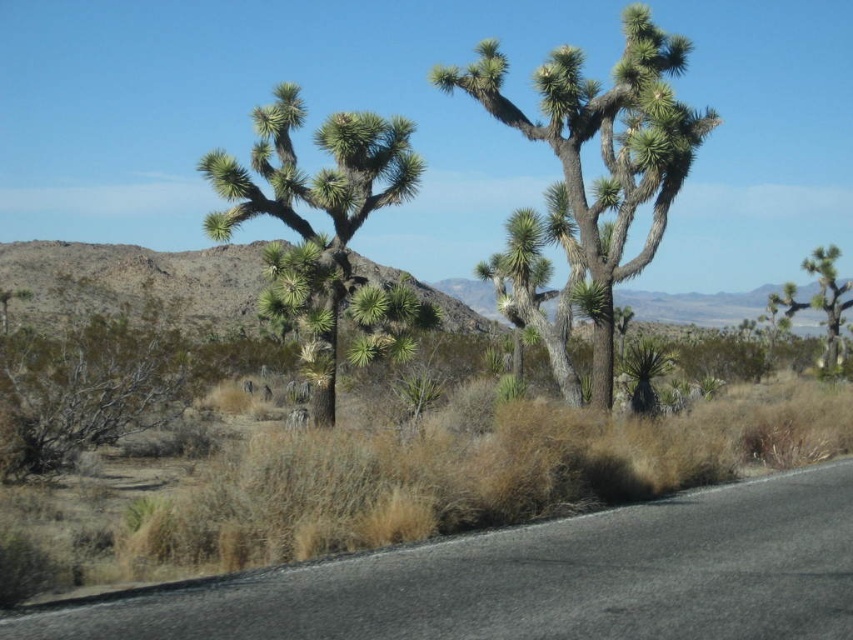
Question: Among these objects, which one is nearest to the camera?

Choices:
 (A) green spiky cactus at center
 (B) green spiky cactus at right
 (C) green spiky plant at center

Answer: (C)

Question: Which object appears farthest from the camera in this image?

Choices:
 (A) green spiky cactus at center
 (B) green spiky cactus at right

Answer: (B)

Question: Does green spiky plant at center have a larger size compared to green spiky cactus at center?

Choices:
 (A) yes
 (B) no

Answer: (B)

Question: In this image, where is green spiky plant at center located relative to green spiky cactus at right?

Choices:
 (A) above
 (B) below

Answer: (A)

Question: Can you confirm if green spiky cactus at center is positioned to the right of green spiky cactus at right?

Choices:
 (A) no
 (B) yes

Answer: (A)

Question: Which is nearer to the green spiky cactus at center?

Choices:
 (A) green spiky cactus at right
 (B) green spiky plant at center

Answer: (B)